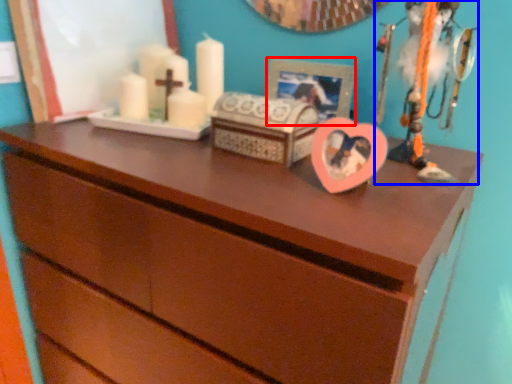
Question: Which object appears closest to the camera in this image, picture frame (highlighted by a red box) or toy (highlighted by a blue box)?

Choices:
 (A) picture frame
 (B) toy

Answer: (B)